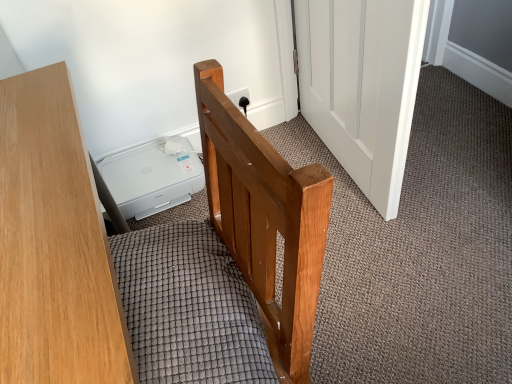
Question: From a real-world perspective, is wooden desk at left over textured gray mattress at center?

Choices:
 (A) yes
 (B) no

Answer: (B)

Question: Is wooden desk at left touching textured gray mattress at center?

Choices:
 (A) no
 (B) yes

Answer: (A)

Question: Can you confirm if wooden desk at left is positioned to the right of textured gray mattress at center?

Choices:
 (A) no
 (B) yes

Answer: (A)

Question: Is wooden desk at left positioned far away from textured gray mattress at center?

Choices:
 (A) no
 (B) yes

Answer: (A)

Question: Does wooden desk at left have a greater width compared to textured gray mattress at center?

Choices:
 (A) yes
 (B) no

Answer: (A)

Question: Considering their positions, is textured gray mattress at center located in front of or behind white wooden door at center?

Choices:
 (A) behind
 (B) front

Answer: (B)

Question: Based on their sizes in the image, would you say textured gray mattress at center is bigger or smaller than white wooden door at center?

Choices:
 (A) big
 (B) small

Answer: (B)

Question: Considering the relative positions of textured gray mattress at center and white wooden door at center in the image provided, is textured gray mattress at center to the left or to the right of white wooden door at center?

Choices:
 (A) right
 (B) left

Answer: (B)

Question: In terms of height, does textured gray mattress at center look taller or shorter compared to white wooden door at center?

Choices:
 (A) tall
 (B) short

Answer: (B)

Question: Is point (400, 84) closer or farther from the camera than point (181, 259)?

Choices:
 (A) farther
 (B) closer

Answer: (A)

Question: In the image, is white wooden door at center positioned in front of or behind textured gray mattress at center?

Choices:
 (A) front
 (B) behind

Answer: (B)

Question: In terms of width, does white wooden door at center look wider or thinner when compared to textured gray mattress at center?

Choices:
 (A) thin
 (B) wide

Answer: (A)

Question: Looking at the image, does white wooden door at center seem bigger or smaller compared to textured gray mattress at center?

Choices:
 (A) small
 (B) big

Answer: (B)

Question: In the image, is textured gray mattress at center on the left side or the right side of wooden desk at left?

Choices:
 (A) left
 (B) right

Answer: (B)

Question: Is textured gray mattress at center inside or outside of wooden desk at left?

Choices:
 (A) inside
 (B) outside

Answer: (B)